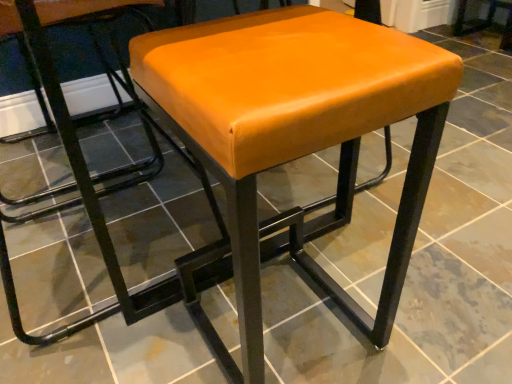
Find the location of a particular element. The width and height of the screenshot is (512, 384). vacant region below orange leather stool at center (from a real-world perspective) is located at coordinates (303, 336).